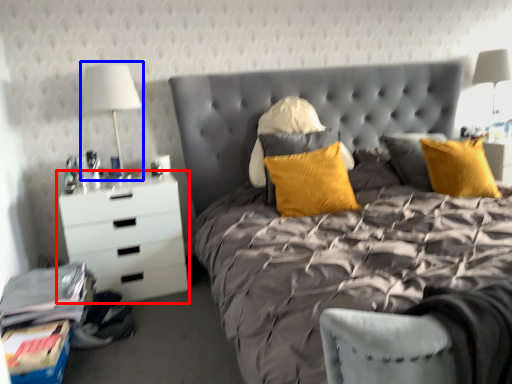
Question: Which object appears farthest to the camera in this image, chest of drawers (highlighted by a red box) or bedside lamp (highlighted by a blue box)?

Choices:
 (A) chest of drawers
 (B) bedside lamp

Answer: (B)